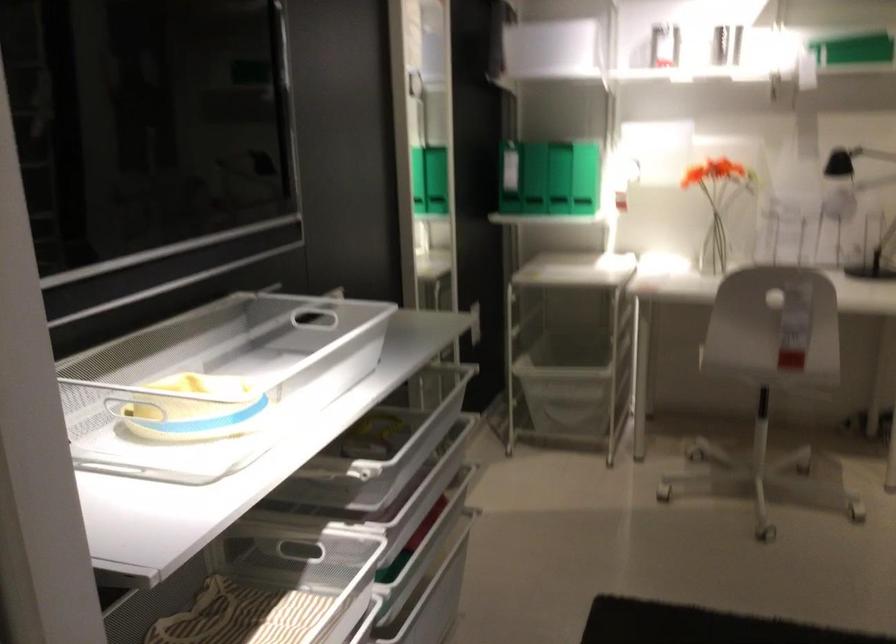
The width and height of the screenshot is (896, 644). What do you see at coordinates (776, 292) in the screenshot? I see `the chair sitting surface` at bounding box center [776, 292].